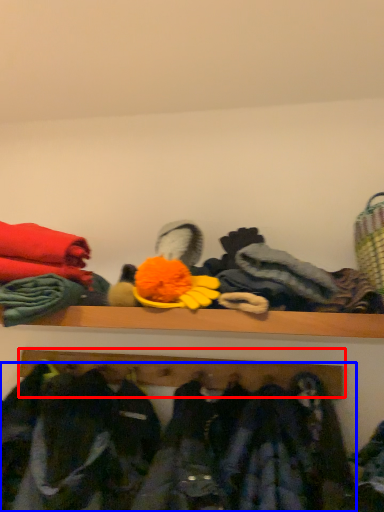
Question: Among these objects, which one is farthest to the camera, shelf (highlighted by a red box) or clothing (highlighted by a blue box)?

Choices:
 (A) shelf
 (B) clothing

Answer: (A)